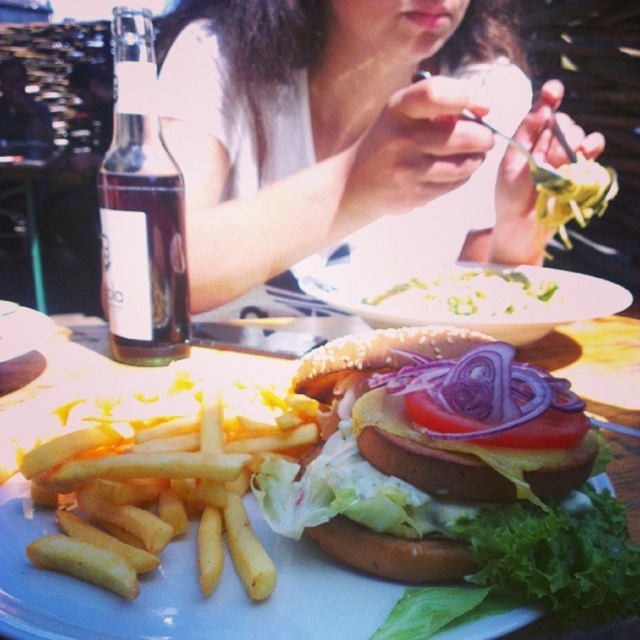
Looking at this image, is matte white shirt at center above smooth creamy pasta at center?

Correct, matte white shirt at center is located above smooth creamy pasta at center.

Where is `matte white shirt at center`? The image size is (640, 640). matte white shirt at center is located at coordinates (316, 122).

Is matte white shirt at center thinner than golden crispy french fries at lower left?

No, matte white shirt at center is not thinner than golden crispy french fries at lower left.

Who is lower down, matte white shirt at center or golden crispy french fries at lower left?

golden crispy french fries at lower left is lower down.

Locate an element on the screen. matte white shirt at center is located at coordinates (316, 122).

Can you confirm if shiny brown bun at center is positioned above green leafy lettuce at lower center?

Yes, shiny brown bun at center is above green leafy lettuce at lower center.

Which of these two, shiny brown bun at center or green leafy lettuce at lower center, stands taller?

Standing taller between the two is shiny brown bun at center.

Measure the distance between point (x=438, y=426) and camera.

They are 13.94 inches apart.

Locate an element on the screen. The height and width of the screenshot is (640, 640). shiny brown bun at center is located at coordinates (422, 448).